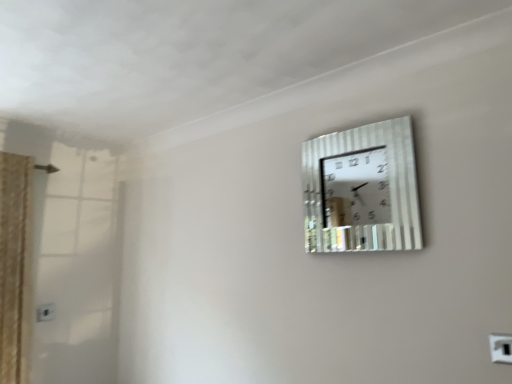
What do you see at coordinates (362, 189) in the screenshot? The width and height of the screenshot is (512, 384). I see `metallic silver wall clock at upper right` at bounding box center [362, 189].

Find the location of a particular element. The image size is (512, 384). white plastic electric outlet at upper right, which appears as the 2th electric outlet when viewed from the left is located at coordinates (501, 348).

Is point (497, 360) behind point (394, 174)?

No, (497, 360) is closer to viewer.

Based on their positions, is white plastic electric outlet at upper right, the 2th electric outlet from the back, located to the left or right of metallic silver wall clock at upper right?

white plastic electric outlet at upper right, the 2th electric outlet from the back, is to the right of metallic silver wall clock at upper right.

From a real-world perspective, is white plastic electric outlet at upper right, the first electric outlet positioned from the top, below metallic silver wall clock at upper right?

Yes, from a real-world perspective, white plastic electric outlet at upper right, the first electric outlet positioned from the top, is beneath metallic silver wall clock at upper right.

Which is behind, white plastic electric outlet at upper right, marked as the 2th electric outlet in a bottom-to-top arrangement, or metallic silver wall clock at upper right?

metallic silver wall clock at upper right is further from the camera.

Are white plastic electric outlet at lower left, the first electric outlet when ordered from back to front, and white plastic electric outlet at upper right, marked as the 1th electric outlet in a right-to-left arrangement, located far from each other?

Yes.

Is white plastic electric outlet at lower left, positioned as the 1th electric outlet in bottom-to-top order, positioned with its back to white plastic electric outlet at upper right, marked as the 1th electric outlet in a right-to-left arrangement?

That's not correct — white plastic electric outlet at lower left, positioned as the 1th electric outlet in bottom-to-top order, is not looking away from white plastic electric outlet at upper right, marked as the 1th electric outlet in a right-to-left arrangement.

From a real-world perspective, is white plastic electric outlet at lower left, placed as the 1th electric outlet when sorted from left to right, under white plastic electric outlet at upper right, the 2th electric outlet from the back?

Incorrect, from a real-world perspective, white plastic electric outlet at lower left, placed as the 1th electric outlet when sorted from left to right, is higher than white plastic electric outlet at upper right, the 2th electric outlet from the back.

Does white plastic electric outlet at lower left, the 2th electric outlet viewed from the front, come behind white plastic electric outlet at upper right, marked as the 2th electric outlet in a bottom-to-top arrangement?

Yes, the depth of white plastic electric outlet at lower left, the 2th electric outlet viewed from the front, is greater than that of white plastic electric outlet at upper right, marked as the 2th electric outlet in a bottom-to-top arrangement.

Can you confirm if metallic silver wall clock at upper right is taller than white plastic electric outlet at upper right, marked as the 1th electric outlet in a right-to-left arrangement?

Yes, metallic silver wall clock at upper right is taller than white plastic electric outlet at upper right, marked as the 1th electric outlet in a right-to-left arrangement.

Is metallic silver wall clock at upper right placed right next to white plastic electric outlet at upper right, which is the first electric outlet in front-to-back order?

They are not placed beside each other.

How far apart are metallic silver wall clock at upper right and white plastic electric outlet at upper right, marked as the 1th electric outlet in a right-to-left arrangement?

5.78 feet.

Considering the relative sizes of metallic silver wall clock at upper right and white plastic electric outlet at upper right, which is the first electric outlet in front-to-back order, in the image provided, is metallic silver wall clock at upper right smaller than white plastic electric outlet at upper right, which is the first electric outlet in front-to-back order,?

No, metallic silver wall clock at upper right is not smaller than white plastic electric outlet at upper right, which is the first electric outlet in front-to-back order.

Is metallic silver wall clock at upper right surrounding white plastic electric outlet at lower left, the first electric outlet when ordered from back to front?

That's incorrect, white plastic electric outlet at lower left, the first electric outlet when ordered from back to front, is not inside metallic silver wall clock at upper right.

From the image's perspective, which is below, metallic silver wall clock at upper right or white plastic electric outlet at lower left, the first electric outlet when ordered from back to front?

From the image's view, white plastic electric outlet at lower left, the first electric outlet when ordered from back to front, is below.

Is white plastic electric outlet at upper right, marked as the 2th electric outlet in a bottom-to-top arrangement, further to the viewer compared to white plastic electric outlet at lower left, positioned as the 1th electric outlet in bottom-to-top order?

No, it is not.

In the image, is white plastic electric outlet at upper right, marked as the 2th electric outlet in a bottom-to-top arrangement, on the left side or the right side of white plastic electric outlet at lower left, positioned as the 1th electric outlet in bottom-to-top order?

Clearly, white plastic electric outlet at upper right, marked as the 2th electric outlet in a bottom-to-top arrangement, is on the right of white plastic electric outlet at lower left, positioned as the 1th electric outlet in bottom-to-top order, in the image.

Can you see white plastic electric outlet at upper right, marked as the 1th electric outlet in a right-to-left arrangement, touching white plastic electric outlet at lower left, placed as the 1th electric outlet when sorted from left to right?

No, white plastic electric outlet at upper right, marked as the 1th electric outlet in a right-to-left arrangement, is not touching white plastic electric outlet at lower left, placed as the 1th electric outlet when sorted from left to right.

From the picture: Can you tell me how much white plastic electric outlet at upper right, the first electric outlet positioned from the top, and white plastic electric outlet at lower left, positioned as the 1th electric outlet in bottom-to-top order, differ in facing direction?

The angular difference between white plastic electric outlet at upper right, the first electric outlet positioned from the top, and white plastic electric outlet at lower left, positioned as the 1th electric outlet in bottom-to-top order, is 90.3 degrees.

Looking at this image, from the image's perspective, relative to metallic silver wall clock at upper right, is white plastic electric outlet at lower left, which appears as the second electric outlet when viewed from the right, above or below?

white plastic electric outlet at lower left, which appears as the second electric outlet when viewed from the right, is below metallic silver wall clock at upper right.

At what (x,y) coordinates should I click in order to perform the action: click on wall clock above the white plastic electric outlet at lower left, the 2th electric outlet viewed from the front (from the image's perspective). Please return your answer as a coordinate pair (x, y). Looking at the image, I should click on (362, 189).

Is white plastic electric outlet at lower left, which ranks as the 2th electric outlet in top-to-bottom order, to the right of metallic silver wall clock at upper right from the viewer's perspective?

In fact, white plastic electric outlet at lower left, which ranks as the 2th electric outlet in top-to-bottom order, is to the left of metallic silver wall clock at upper right.

Is the depth of white plastic electric outlet at lower left, the 2th electric outlet viewed from the front, less than that of metallic silver wall clock at upper right?

That is False.

There is a white plastic electric outlet at upper right, which is the first electric outlet in front-to-back order. Identify the location of wall clock above it (from a real-world perspective). This screenshot has height=384, width=512. (362, 189).

What are the coordinates of `electric outlet that is on the right side of white plastic electric outlet at lower left, the 2th electric outlet viewed from the front` in the screenshot? It's located at (501, 348).

When comparing their distances from white plastic electric outlet at upper right, the first electric outlet positioned from the top, does metallic silver wall clock at upper right or white plastic electric outlet at lower left, which appears as the second electric outlet when viewed from the right, seem further?

The object further to white plastic electric outlet at upper right, the first electric outlet positioned from the top, is white plastic electric outlet at lower left, which appears as the second electric outlet when viewed from the right.

When comparing their distances from white plastic electric outlet at upper right, the 2th electric outlet from the back, does white plastic electric outlet at lower left, positioned as the 1th electric outlet in bottom-to-top order, or metallic silver wall clock at upper right seem further?

The object further to white plastic electric outlet at upper right, the 2th electric outlet from the back, is white plastic electric outlet at lower left, positioned as the 1th electric outlet in bottom-to-top order.

Considering their positions, is white plastic electric outlet at upper right, which is the first electric outlet in front-to-back order, positioned further to white plastic electric outlet at lower left, placed as the 1th electric outlet when sorted from left to right, than metallic silver wall clock at upper right?

white plastic electric outlet at upper right, which is the first electric outlet in front-to-back order, is further to white plastic electric outlet at lower left, placed as the 1th electric outlet when sorted from left to right.

Estimate the real-world distances between objects in this image. Which object is closer to metallic silver wall clock at upper right, white plastic electric outlet at upper right, marked as the 1th electric outlet in a right-to-left arrangement, or white plastic electric outlet at lower left, positioned as the 1th electric outlet in bottom-to-top order?

white plastic electric outlet at upper right, marked as the 1th electric outlet in a right-to-left arrangement.

When comparing their distances from metallic silver wall clock at upper right, does white plastic electric outlet at lower left, the first electric outlet when ordered from back to front, or white plastic electric outlet at upper right, which is the first electric outlet in front-to-back order, seem closer?

white plastic electric outlet at upper right, which is the first electric outlet in front-to-back order, is positioned closer to the anchor metallic silver wall clock at upper right.

Based on their spatial positions, is metallic silver wall clock at upper right or white plastic electric outlet at upper right, marked as the 1th electric outlet in a right-to-left arrangement, closer to white plastic electric outlet at lower left, which appears as the second electric outlet when viewed from the right?

metallic silver wall clock at upper right lies closer to white plastic electric outlet at lower left, which appears as the second electric outlet when viewed from the right, than the other object.

Locate an element on the screen. wall clock between white plastic electric outlet at lower left, which appears as the second electric outlet when viewed from the right, and white plastic electric outlet at upper right, the first electric outlet positioned from the top, from left to right is located at coordinates (362, 189).